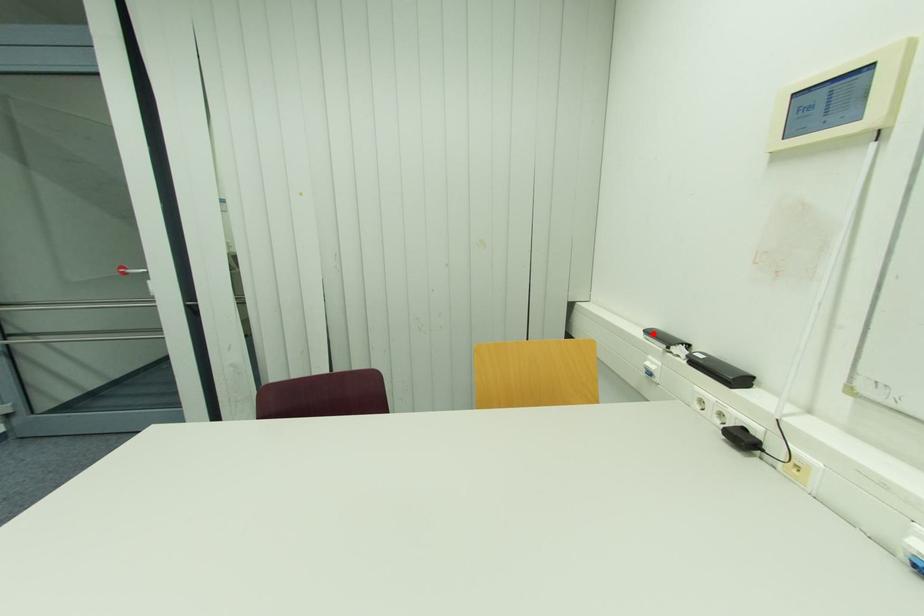
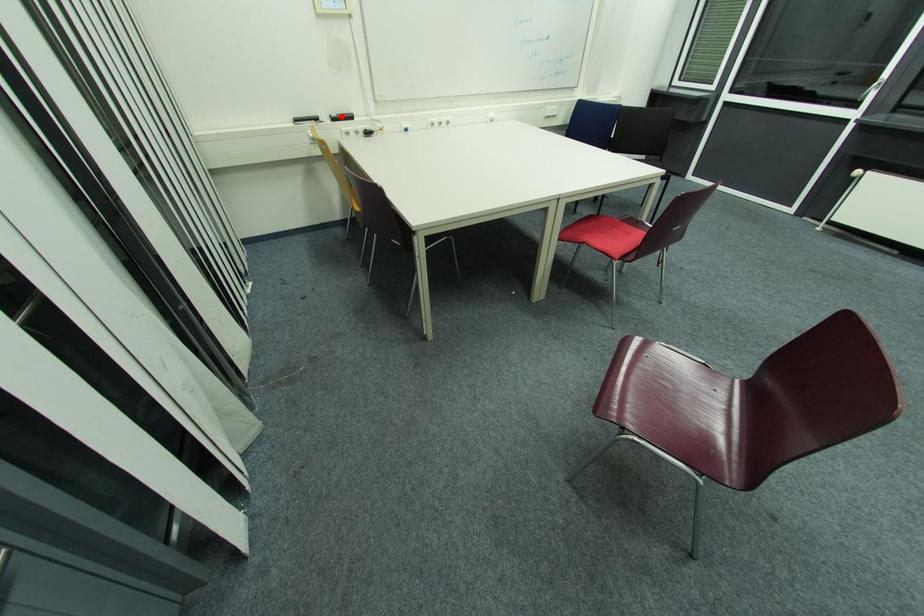
I am providing you with two images of the same scene from different viewpoints. A red point is marked on the first image and another point is marked on the second image. Is the marked point in image1 the same physical position as the marked point in image2?

No